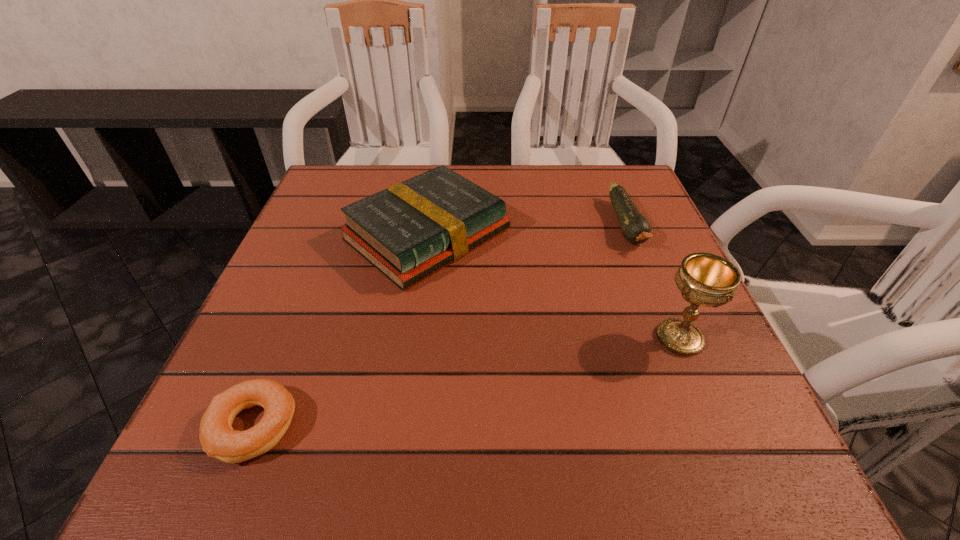
Identify the location of free space at the far edge. This screenshot has height=540, width=960. pos(450,166).

The image size is (960, 540). Find the location of `vacant space at the near edge of the desktop`. vacant space at the near edge of the desktop is located at coordinates (595, 433).

Locate an element on the screen. vacant area at the left edge is located at coordinates (351, 284).

I want to click on vacant space at the right edge, so click(632, 356).

Locate an element on the screen. vacant space at the far left corner of the desktop is located at coordinates (345, 181).

In order to click on free space at the near left corner in this screenshot , I will do `click(181, 468)`.

Locate an element on the screen. This screenshot has width=960, height=540. vacant space at the far right corner of the desktop is located at coordinates (636, 197).

Find the location of a particular element. free location at the near right corner is located at coordinates (701, 437).

Locate an element on the screen. Image resolution: width=960 pixels, height=540 pixels. unoccupied position between the chalice and the bagel is located at coordinates (467, 382).

Where is `free area in between the tallest object and the third tallest object`? The height and width of the screenshot is (540, 960). free area in between the tallest object and the third tallest object is located at coordinates (653, 281).